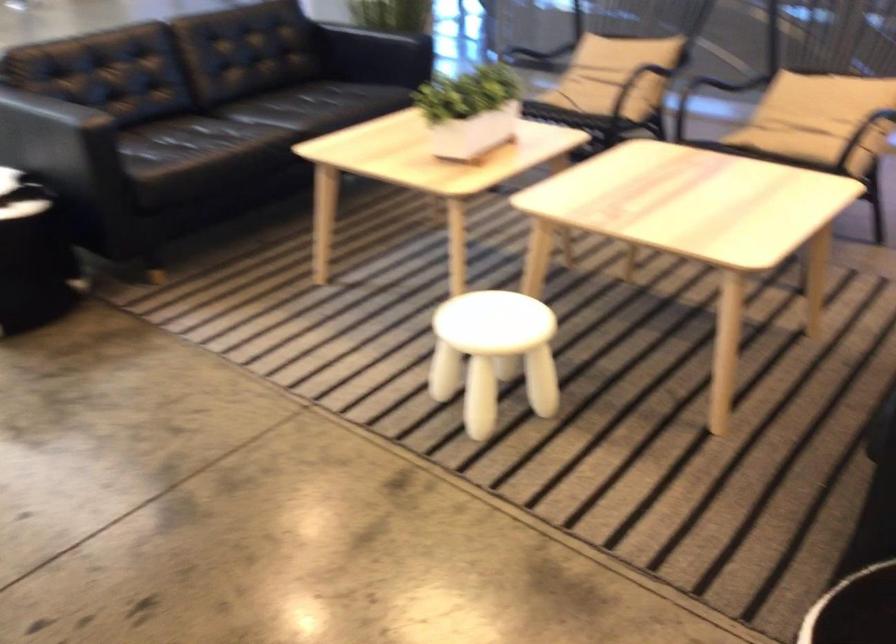
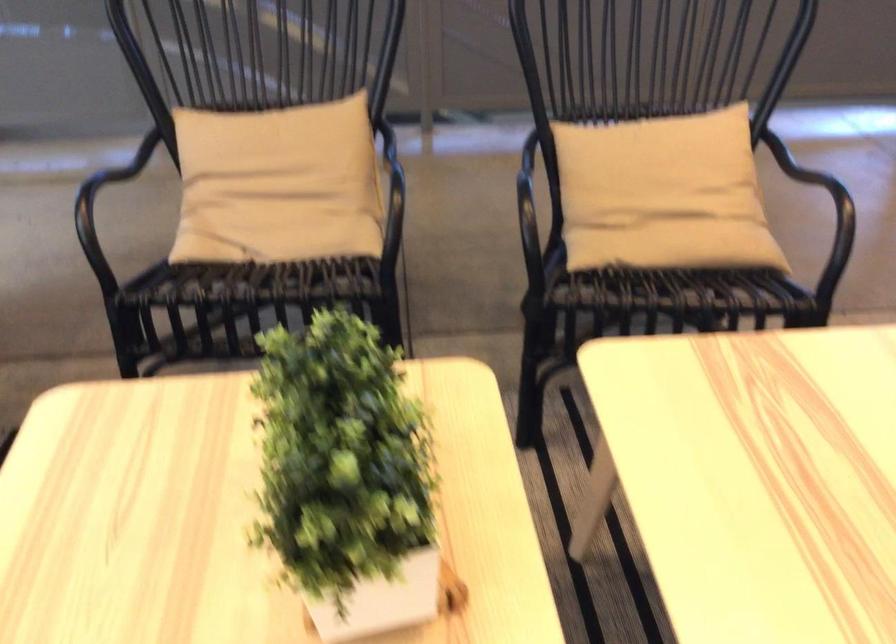
The point at (562, 106) is marked in the first image. Where is the corresponding point in the second image?

(268, 267)